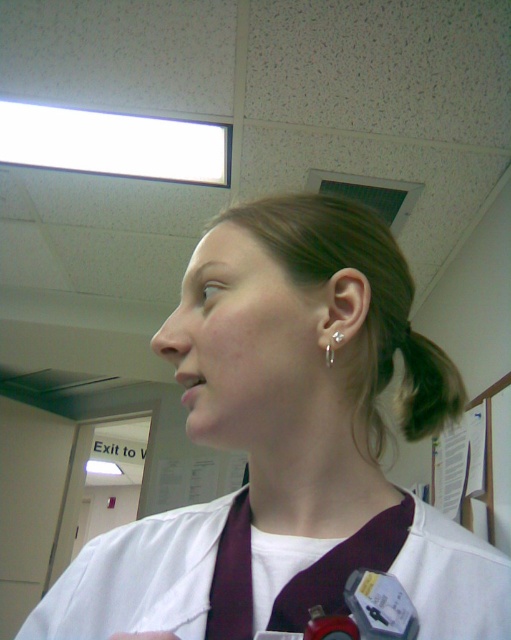
You are a visitor in a hospital and want to locate the exit marked by the sign. You see the dark brown hair at upper right and the white matte lab coat at center. Which object is positioned more to the right side of the image?

The dark brown hair at upper right is positioned more to the right side of the image than the white matte lab coat at center.

You are a person who is 5 feet 6 inches tall. You are standing in a hospital corridor and see the white fabric at center. If you want to touch it, can you reach it without any assistance?

The white fabric at center is 11.70 inches away from the viewer, so yes, a person who is 5 feet 6 inches tall can easily reach it without needing assistance.

You are standing in the hospital and need to reach both the point at coordinates (408, 323) and the point at coordinates (285, 538). Which point will you reach first?

You will reach the point at coordinates (408, 323) first because it is closer to you than the point at coordinates (285, 538), which is further away.